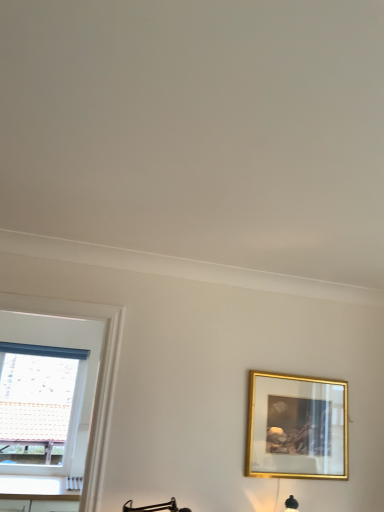
Question: Does gold metallic picture frame at right have a lesser height compared to white plastic window at left?

Choices:
 (A) no
 (B) yes

Answer: (B)

Question: Could you tell me if gold metallic picture frame at right is facing white plastic window at left?

Choices:
 (A) yes
 (B) no

Answer: (B)

Question: Is gold metallic picture frame at right wider than white plastic window at left?

Choices:
 (A) yes
 (B) no

Answer: (B)

Question: Is the depth of gold metallic picture frame at right greater than that of white plastic window at left?

Choices:
 (A) yes
 (B) no

Answer: (B)

Question: Is white plastic window at left inside gold metallic picture frame at right?

Choices:
 (A) yes
 (B) no

Answer: (B)

Question: From a real-world perspective, is gold metallic picture frame at right beneath white plastic window at left?

Choices:
 (A) no
 (B) yes

Answer: (A)

Question: Is white plastic window at left in front of gold metallic picture frame at right?

Choices:
 (A) yes
 (B) no

Answer: (B)

Question: Is white plastic window at left oriented away from gold metallic picture frame at right?

Choices:
 (A) no
 (B) yes

Answer: (A)

Question: Can you confirm if white plastic window at left is positioned to the right of gold metallic picture frame at right?

Choices:
 (A) no
 (B) yes

Answer: (A)

Question: Is white plastic window at left positioned beyond the bounds of gold metallic picture frame at right?

Choices:
 (A) yes
 (B) no

Answer: (A)

Question: Does white plastic window at left have a smaller size compared to gold metallic picture frame at right?

Choices:
 (A) no
 (B) yes

Answer: (A)

Question: Considering the relative sizes of white plastic window at left and gold metallic picture frame at right in the image provided, is white plastic window at left thinner than gold metallic picture frame at right?

Choices:
 (A) no
 (B) yes

Answer: (A)

Question: In the image, is white plastic window at left on the left side or the right side of gold metallic picture frame at right?

Choices:
 (A) right
 (B) left

Answer: (B)